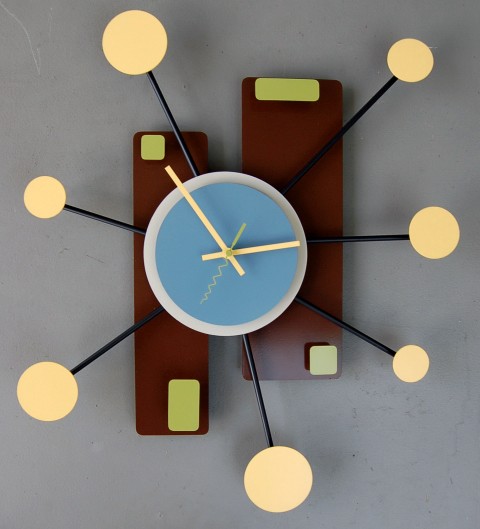
The width and height of the screenshot is (480, 529). In order to click on wall in this screenshot , I will do `click(98, 167)`.